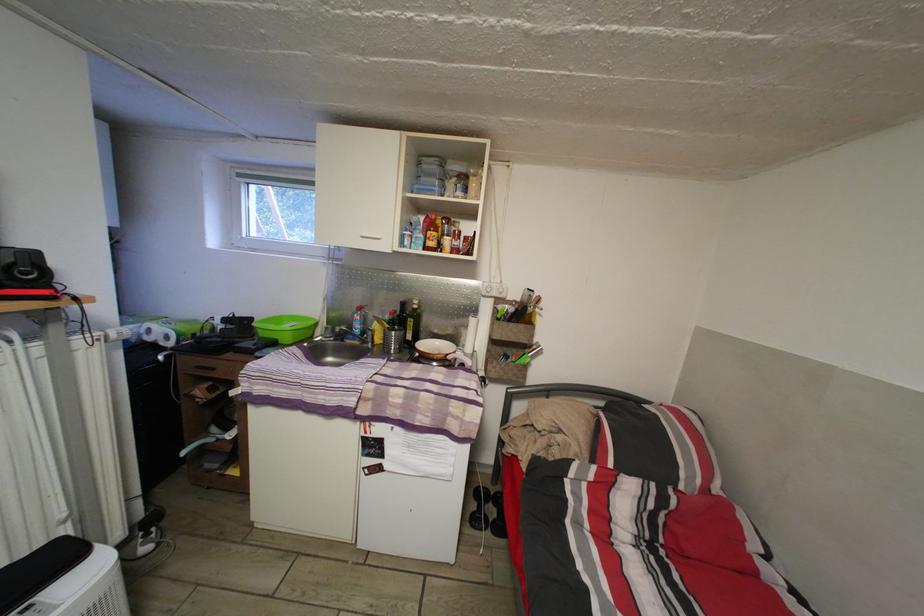
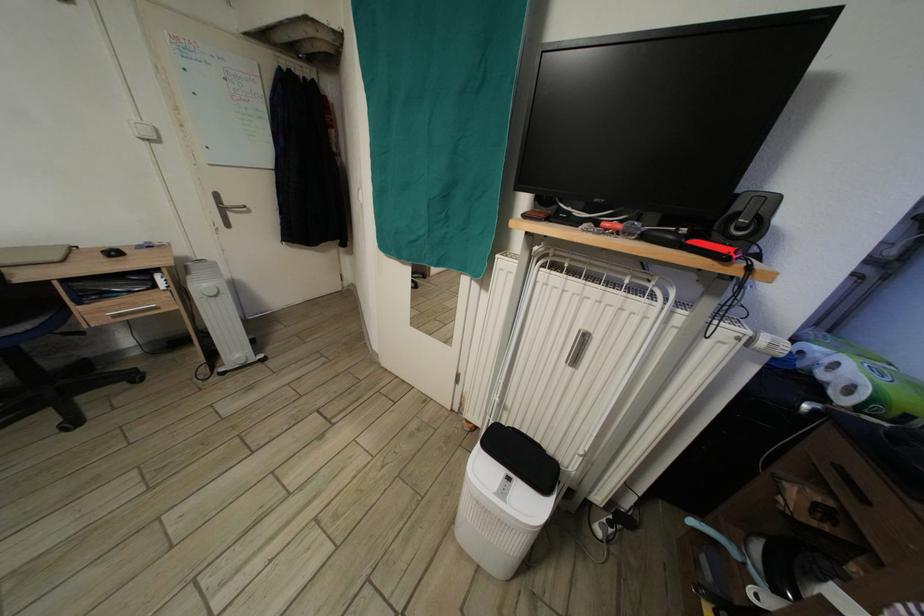
Locate, in the second image, the point that corresponds to [157,345] in the first image.

(830, 383)